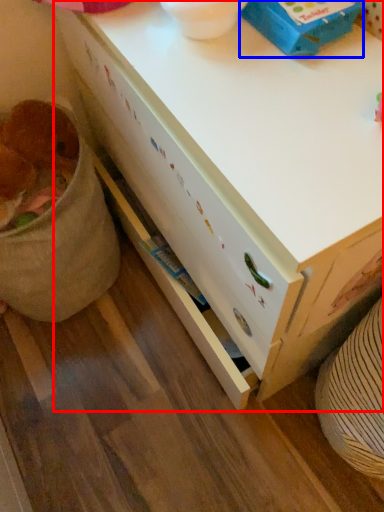
Question: Which object appears farthest to the camera in this image, desk (highlighted by a red box) or box (highlighted by a blue box)?

Choices:
 (A) desk
 (B) box

Answer: (B)